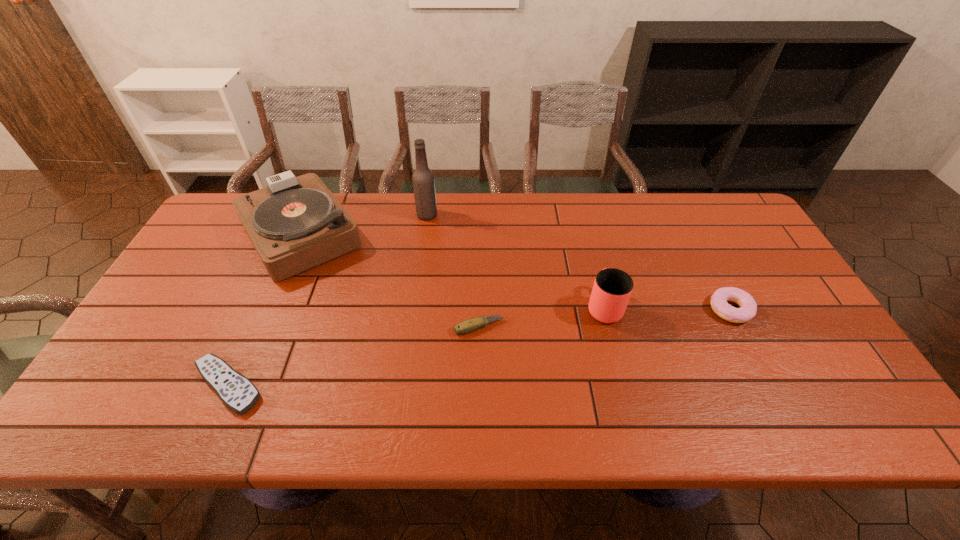
Find the location of `object that is at the right edge`. object that is at the right edge is located at coordinates (748, 307).

Identify the location of object at the far left corner. The image size is (960, 540). (295, 223).

At what (x,y) coordinates should I click in order to perform the action: click on free space at the far edge. Please return your answer as a coordinate pair (x, y). Looking at the image, I should click on (513, 224).

The height and width of the screenshot is (540, 960). What are the coordinates of `free location at the near edge` in the screenshot? It's located at (201, 420).

Find the location of a particular element. The image size is (960, 540). vacant space at the left edge of the desktop is located at coordinates (168, 301).

This screenshot has height=540, width=960. Identify the location of free space at the right edge. (778, 310).

In order to click on free location at the near left corner in this screenshot , I will do `click(138, 395)`.

What are the coordinates of `blank area at the far right corner` in the screenshot? It's located at (727, 212).

Locate an element on the screen. This screenshot has height=540, width=960. empty location between the third object from left to right and the third shortest object is located at coordinates (579, 262).

The height and width of the screenshot is (540, 960). I want to click on free point between the pocketknife and the record player, so click(x=390, y=280).